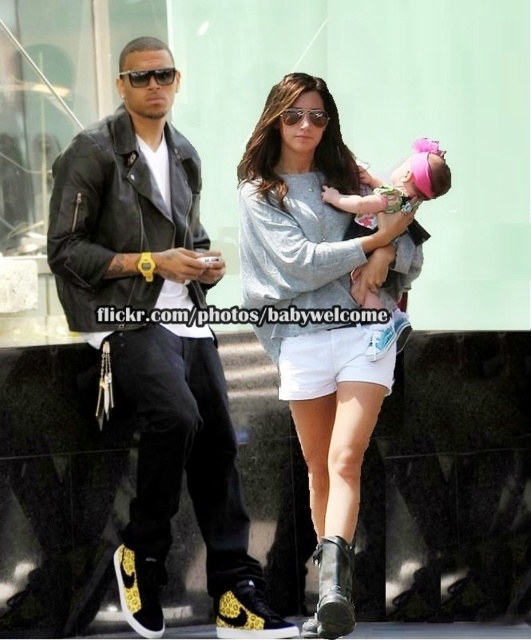
Who is taller, gray cotton sweater at center or white cotton shorts at center?

gray cotton sweater at center

Does gray cotton sweater at center have a smaller size compared to white cotton shorts at center?

No.

This screenshot has height=640, width=531. I want to click on gray cotton sweater at center, so click(303, 204).

Locate an element on the screen. gray cotton sweater at center is located at coordinates (x=303, y=204).

In the scene shown: Can you confirm if gray cotton sweater at center is positioned above pink fabric baby at center?

No, gray cotton sweater at center is not above pink fabric baby at center.

Which is above, gray cotton sweater at center or pink fabric baby at center?

pink fabric baby at center is higher up.

Locate an element on the screen. This screenshot has height=640, width=531. gray cotton sweater at center is located at coordinates (303, 204).

What are the coordinates of `leather jacket at left` in the screenshot? It's located at pos(131,202).

Between leather jacket at left and pink fabric baby at center, which one has more height?

leather jacket at left

Where is `leather jacket at left`? The height and width of the screenshot is (640, 531). leather jacket at left is located at coordinates (131, 202).